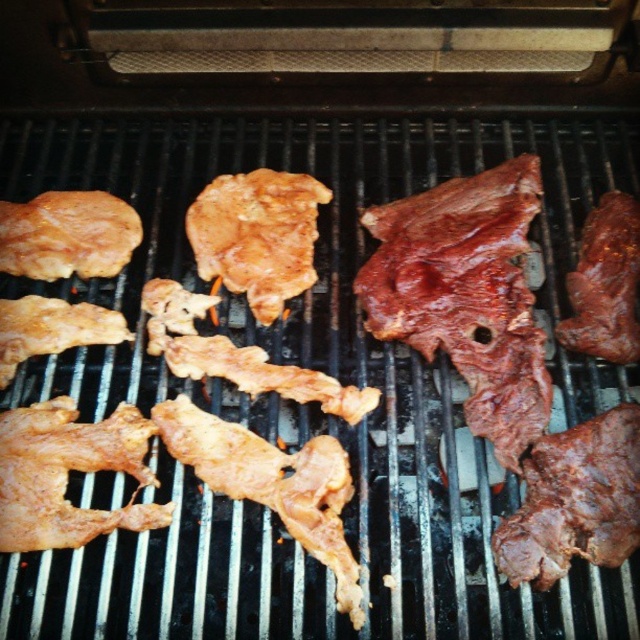
Question: Is golden brown crispy chicken wing at center further to camera compared to golden brown crispy chicken wing at upper left?

Choices:
 (A) yes
 (B) no

Answer: (B)

Question: Which of the following is the farthest from the observer?

Choices:
 (A) dark brown charred steak at right
 (B) shiny brown meat at right
 (C) golden brown crispy chicken wing at center
 (D) brown matte chicken at center

Answer: (D)

Question: Based on their relative distances, which object is farther from the golden brown crispy chicken wing at upper left?

Choices:
 (A) brown matte chicken at center
 (B) golden brown crispy chicken wing at center
 (C) dark brown charred steak at right
 (D) shiny brown meat at right

Answer: (D)

Question: Is golden brown crispy chicken wing at center thinner than golden brown crispy chicken wing at upper left?

Choices:
 (A) yes
 (B) no

Answer: (B)

Question: Which of the following is the farthest from the observer?

Choices:
 (A) brown matte chicken at center
 (B) golden brown crispy chicken wing at upper left

Answer: (B)

Question: Can you confirm if brown matte chicken at center is smaller than shiny brown meat at right?

Choices:
 (A) no
 (B) yes

Answer: (A)